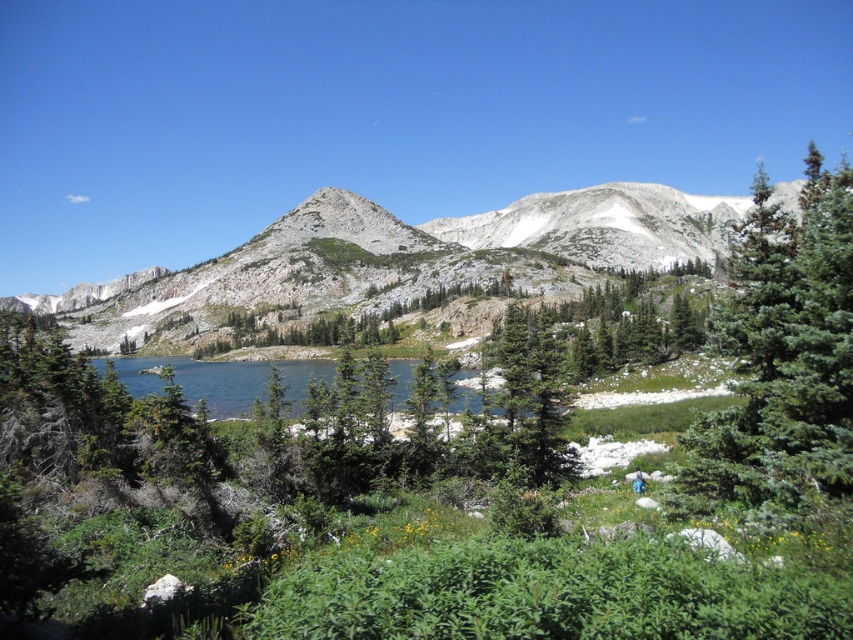
You are planning a hiking trip and want to know the relative sizes of the landscape features. According to the image, which object is wider when comparing the gray rocky mountain at center and the blue glassy water at center?

The gray rocky mountain at center is wider than the blue glassy water at center.

You are a hiker standing in the meadow and want to take a photo of both the green fir tree at right and the blue glassy water at center. Which object should you position closer to the camera to include both in your frame?

To include both the green fir tree at right and the blue glassy water at center in your frame, you should position the green fir tree at right closer to the camera since it is taller than the blue glassy water at center.

You are standing in the meadow and want to take a photo of both the gray rocky mountain at center and the blue glassy water at center. Which one should you focus on first to ensure both are in sharp focus?

You should focus on the gray rocky mountain at center first because it is closer to you than the blue glassy water at center, so adjusting focus from near to far will help both be in sharp focus.